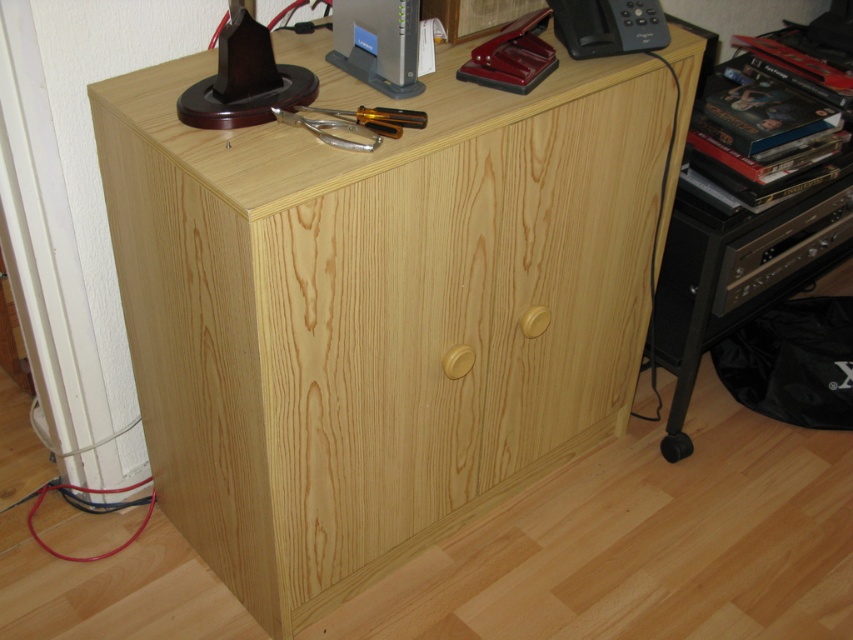
Question: Which of the following is the closest to the observer?

Choices:
 (A) (531, 420)
 (B) (589, 54)

Answer: (B)

Question: Does natural wood cabinet at center appear on the left side of black plastic telephone at upper right?

Choices:
 (A) yes
 (B) no

Answer: (A)

Question: Can you confirm if natural wood cabinet at center is positioned below black plastic telephone at upper right?

Choices:
 (A) yes
 (B) no

Answer: (A)

Question: Where is natural wood cabinet at center located in relation to black plastic telephone at upper right in the image?

Choices:
 (A) above
 (B) below

Answer: (B)

Question: Which object is farther from the camera taking this photo?

Choices:
 (A) black plastic telephone at upper right
 (B) natural wood cabinet at center

Answer: (A)

Question: Which point appears closest to the camera in this image?

Choices:
 (A) (654, 44)
 (B) (576, 396)

Answer: (A)